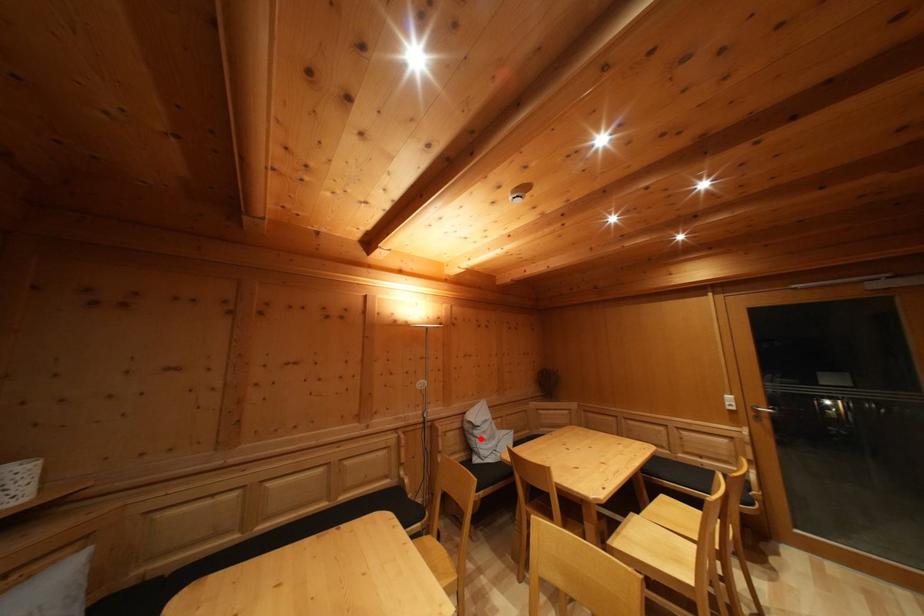
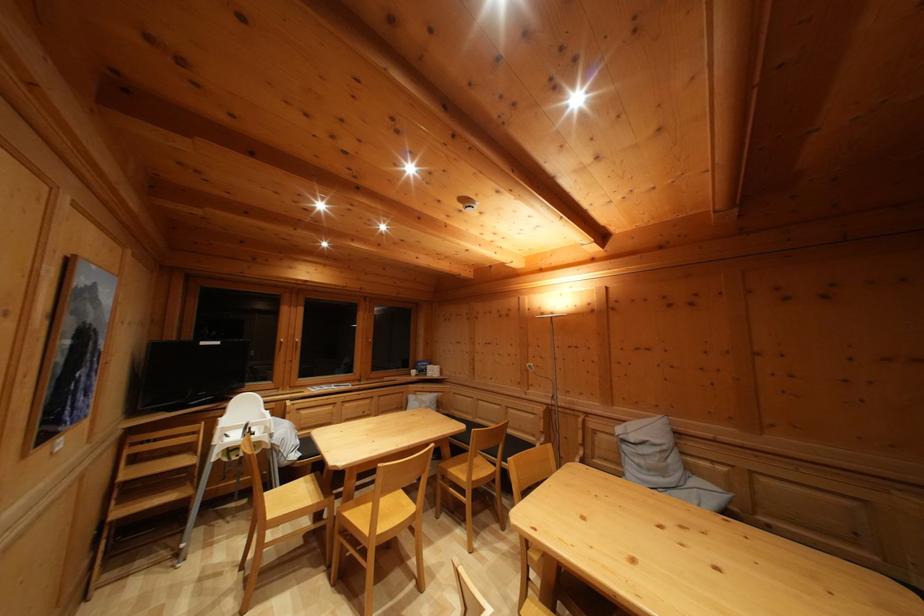
Question: A red point is marked in image1. In image2, is the corresponding 3D point closer to the camera or farther? Reply with the corresponding letter.

Choices:
 (A) The corresponding 3D point is closer.
 (B) The corresponding 3D point is farther.

Answer: (A)